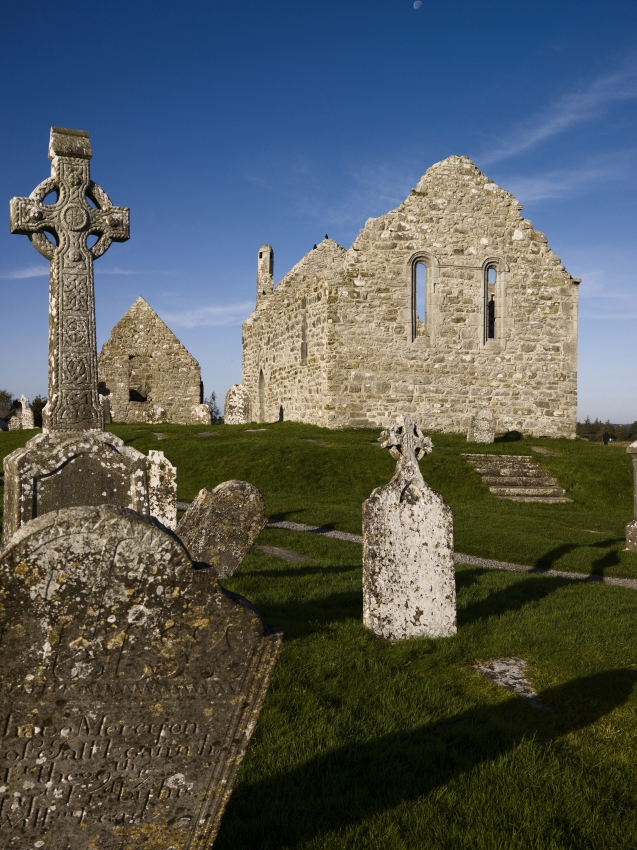
Find the location of a particular element. chimney is located at coordinates (262, 275).